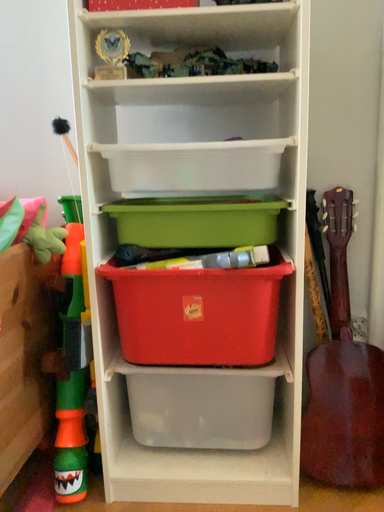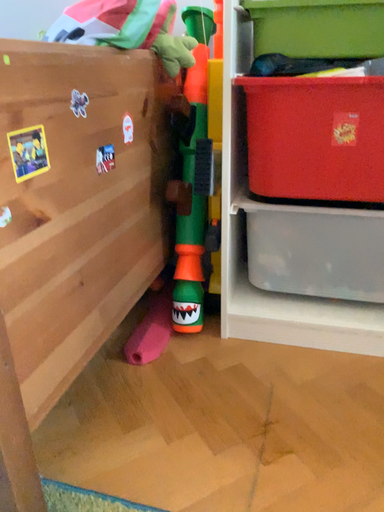
Question: Which way did the camera rotate in the video?

Choices:
 (A) rotated right
 (B) rotated left

Answer: (B)